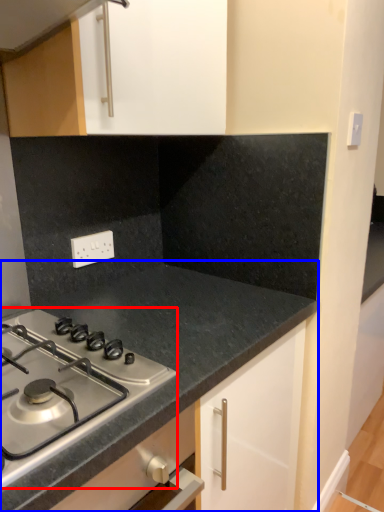
Question: Which object is closer to the camera taking this photo, gas stove (highlighted by a red box) or countertop (highlighted by a blue box)?

Choices:
 (A) gas stove
 (B) countertop

Answer: (A)